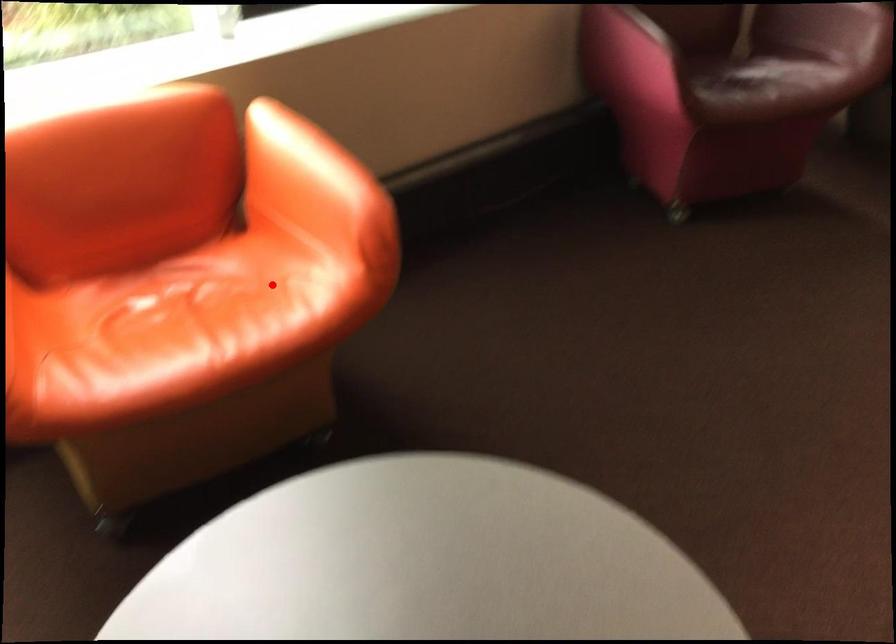
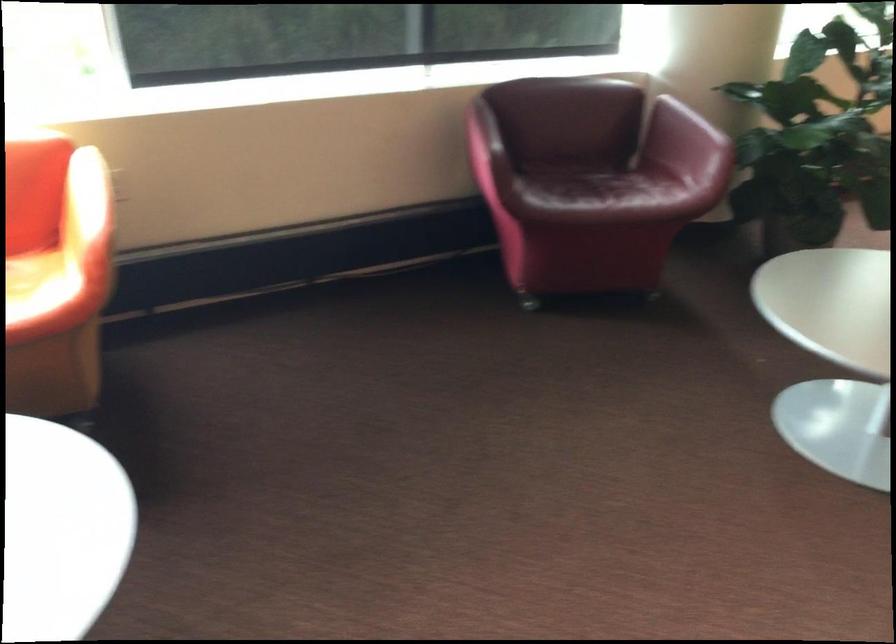
Where in the second image is the point corresponding to the highlighted location from the first image?

(35, 285)